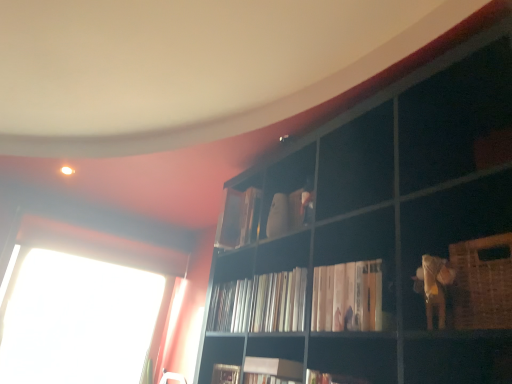
Question: In which direction should I rotate to look at matte white book at upper center, which is the first book in back-to-front order?

Choices:
 (A) right
 (B) left

Answer: (B)

Question: Does white matte book at center, which is the first book in front-to-back order, appear on the right side of white matte bookshelf at center, the 3th book positioned from the back?

Choices:
 (A) yes
 (B) no

Answer: (A)

Question: Is white matte book at center, the fourth book viewed from the back, bigger than white matte bookshelf at center, which is the second book from front to back?

Choices:
 (A) yes
 (B) no

Answer: (A)

Question: Is the depth of white matte book at center, the fourth book viewed from the back, less than that of white matte bookshelf at center, the 3th book positioned from the back?

Choices:
 (A) no
 (B) yes

Answer: (B)

Question: Considering the relative sizes of white matte book at center, the fourth book viewed from the back, and white matte bookshelf at center, which is the second book from front to back, in the image provided, is white matte book at center, the fourth book viewed from the back, wider than white matte bookshelf at center, which is the second book from front to back,?

Choices:
 (A) no
 (B) yes

Answer: (A)

Question: Considering the relative sizes of white matte book at center, which is the first book in front-to-back order, and white matte bookshelf at center, the 3th book positioned from the back, in the image provided, is white matte book at center, which is the first book in front-to-back order, smaller than white matte bookshelf at center, the 3th book positioned from the back,?

Choices:
 (A) no
 (B) yes

Answer: (A)

Question: Can you confirm if white matte book at center, which is the first book in front-to-back order, is thinner than white matte bookshelf at center, the 3th book positioned from the back?

Choices:
 (A) no
 (B) yes

Answer: (B)

Question: Is matte white book at upper center, the 4th book when ordered from front to back, at the left side of woven brown basket at lower right?

Choices:
 (A) yes
 (B) no

Answer: (A)

Question: From a real-world perspective, does matte white book at upper center, which is the first book in back-to-front order, stand above woven brown basket at lower right?

Choices:
 (A) no
 (B) yes

Answer: (B)

Question: Is matte white book at upper center, the 4th book when ordered from front to back, positioned before woven brown basket at lower right?

Choices:
 (A) yes
 (B) no

Answer: (B)

Question: From the image's perspective, is matte white book at upper center, the 4th book when ordered from front to back, beneath woven brown basket at lower right?

Choices:
 (A) no
 (B) yes

Answer: (A)

Question: Does matte white book at upper center, the 4th book when ordered from front to back, have a greater width compared to woven brown basket at lower right?

Choices:
 (A) no
 (B) yes

Answer: (B)

Question: Could you tell me if matte white book at upper center, the 4th book when ordered from front to back, is turned towards woven brown basket at lower right?

Choices:
 (A) yes
 (B) no

Answer: (B)

Question: Considering the relative sizes of white matte book at center, the fourth book viewed from the back, and white glossy books at center in the image provided, is white matte book at center, the fourth book viewed from the back, shorter than white glossy books at center?

Choices:
 (A) no
 (B) yes

Answer: (B)